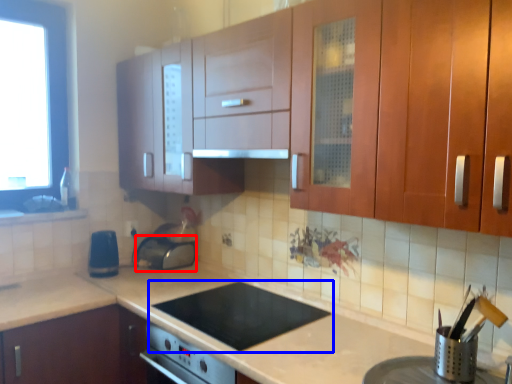
Question: Which object is further to the camera taking this photo, appliance (highlighted by a red box) or gas stove (highlighted by a blue box)?

Choices:
 (A) appliance
 (B) gas stove

Answer: (A)